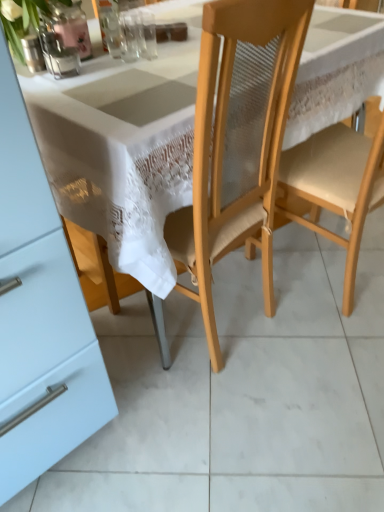
Find the location of a particular element. vacant area that is in front of light wood chair at center, the 2th chair in the left-to-right sequence is located at coordinates (317, 358).